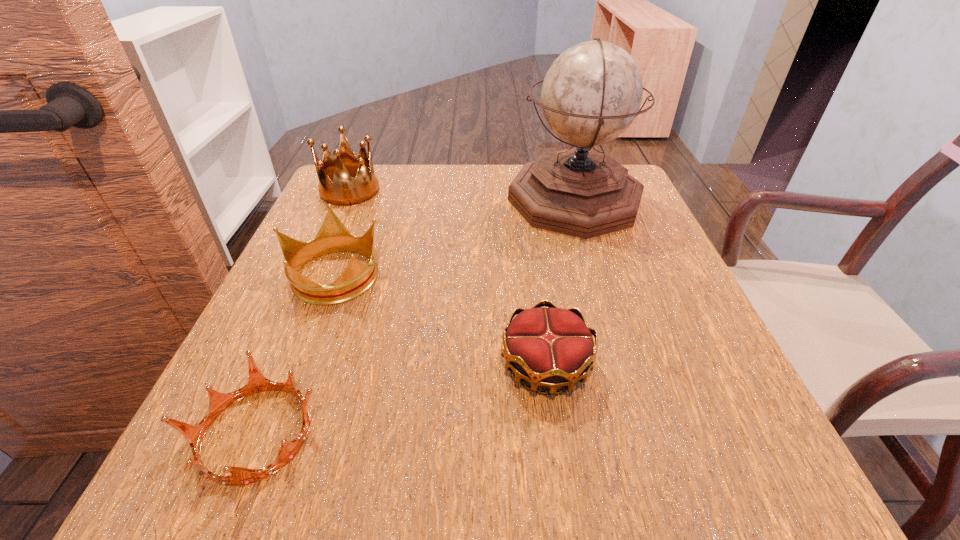
Image resolution: width=960 pixels, height=540 pixels. What are the coordinates of `globe` in the screenshot? It's located at (591, 94).

This screenshot has width=960, height=540. What are the coordinates of `the tallest crown` in the screenshot? It's located at (336, 186).

Image resolution: width=960 pixels, height=540 pixels. In order to click on the second tallest object in this screenshot , I will do `click(336, 186)`.

The image size is (960, 540). I want to click on the second tallest crown, so click(x=333, y=236).

You are a GUI agent. You are given a task and a screenshot of the screen. Output one action in this format:
    pyautogui.click(x=<x>, y=<y>)
    Task: Click on the third shortest object
    This screenshot has height=540, width=960.
    Given the screenshot: What is the action you would take?
    pyautogui.click(x=333, y=236)

What are the coordinates of `the rightmost crown` in the screenshot? It's located at (552, 347).

At what (x,y) coordinates should I click in order to perform the action: click on free space located on the surface of the globe. Please return your answer as a coordinate pair (x, y). Looking at the image, I should click on (458, 200).

Where is `blank space located 0.300m on the surface of the globe`? blank space located 0.300m on the surface of the globe is located at coordinates (383, 200).

The height and width of the screenshot is (540, 960). In order to click on free point located on the surface of the globe in this screenshot , I will do `click(458, 200)`.

The image size is (960, 540). What are the coordinates of `vacant area situated 0.230m on the right of the fourth shortest object` in the screenshot? It's located at (471, 191).